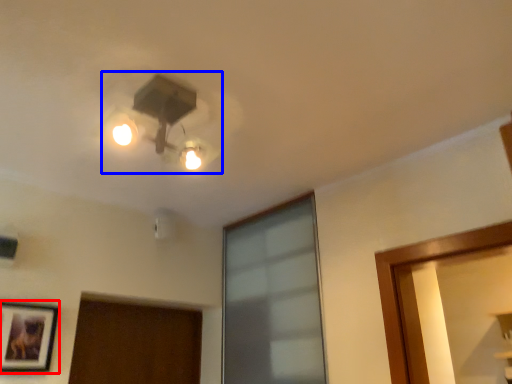
Question: Among these objects, which one is farthest to the camera, picture frame (highlighted by a red box) or lamp (highlighted by a blue box)?

Choices:
 (A) picture frame
 (B) lamp

Answer: (A)